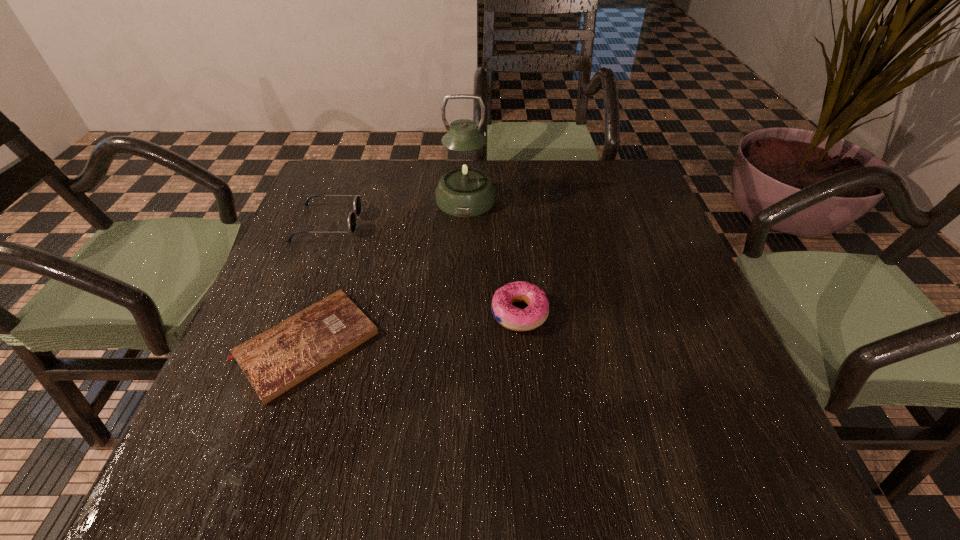
The height and width of the screenshot is (540, 960). I want to click on free space between the doughnut and the Bible, so click(413, 329).

Image resolution: width=960 pixels, height=540 pixels. What are the coordinates of `free space between the Bible and the lantern` in the screenshot? It's located at (386, 272).

Image resolution: width=960 pixels, height=540 pixels. Identify the location of free space that is in between the sunglasses and the doughnut. (423, 268).

Where is `empty space between the shortest object and the tallest object`? The height and width of the screenshot is (540, 960). empty space between the shortest object and the tallest object is located at coordinates (386, 272).

Identify the location of free space between the sunglasses and the tallest object. The image size is (960, 540). (396, 211).

Where is `vacant point located between the sunglasses and the shortest object`? vacant point located between the sunglasses and the shortest object is located at coordinates (317, 284).

Image resolution: width=960 pixels, height=540 pixels. Find the location of `vacant area that lies between the doughnut and the tallest object`. vacant area that lies between the doughnut and the tallest object is located at coordinates (492, 256).

Where is `free space between the doughnut and the lantern`? The height and width of the screenshot is (540, 960). free space between the doughnut and the lantern is located at coordinates (492, 256).

This screenshot has width=960, height=540. In order to click on vacant point located between the sunglasses and the shortest object in this screenshot , I will do `click(317, 284)`.

Choose which object is the third nearest neighbor to the doughnut. Please provide its 2D coordinates. Your answer should be formatted as a tuple, i.e. [(x, y)], where the tuple contains the x and y coordinates of a point satisfying the conditions above.

[(357, 201)]